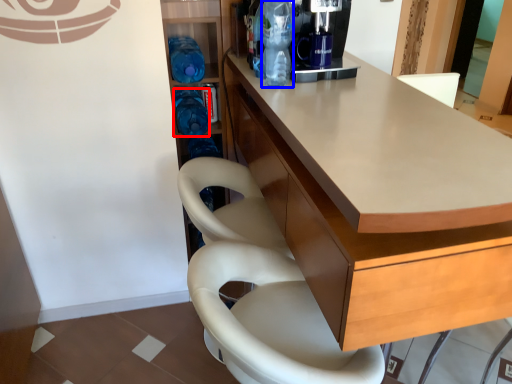
Question: Which object appears farthest to the camera in this image, bottle (highlighted by a red box) or bottle (highlighted by a blue box)?

Choices:
 (A) bottle
 (B) bottle

Answer: (A)